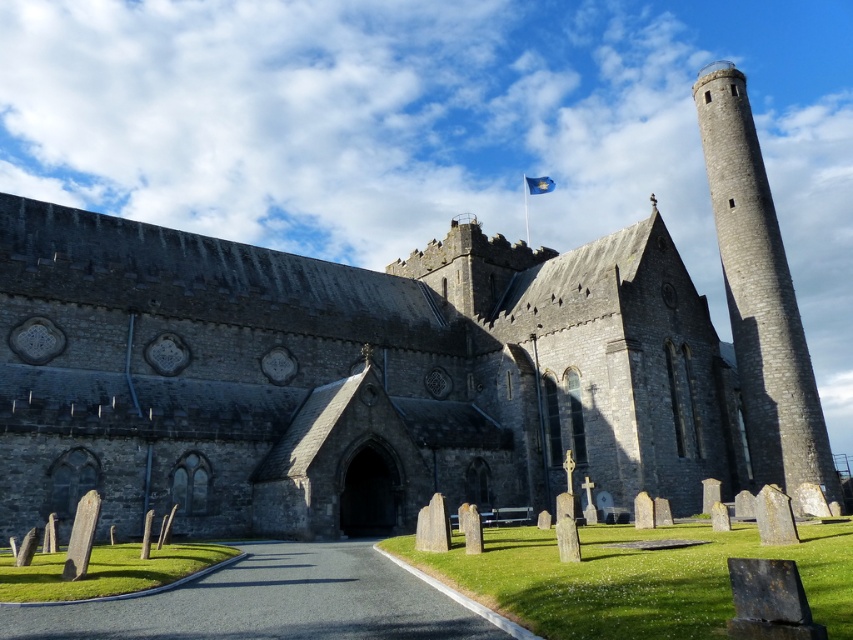
Question: Can you confirm if smooth gray stone tombstone at lower left is smaller than blue fabric flag at upper center?

Choices:
 (A) no
 (B) yes

Answer: (B)

Question: Can you confirm if gray stone tower at right is positioned to the left of smooth gray stone tombstone at lower left?

Choices:
 (A) yes
 (B) no

Answer: (B)

Question: Which point appears farthest from the camera in this image?

Choices:
 (A) (714, 84)
 (B) (84, 493)

Answer: (A)

Question: Which point appears farthest from the camera in this image?

Choices:
 (A) (830, 456)
 (B) (554, 184)

Answer: (B)

Question: Among these objects, which one is nearest to the camera?

Choices:
 (A) gray stone tower at right
 (B) smooth gray stone tombstone at lower left
 (C) blue fabric flag at upper center

Answer: (B)

Question: Does gray stone tower at right appear on the right side of blue fabric flag at upper center?

Choices:
 (A) yes
 (B) no

Answer: (A)